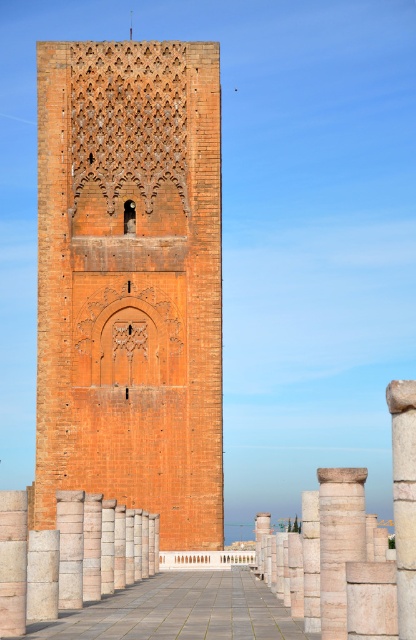
Question: Is light beige stone column at center smaller than smooth stone pillar at left?

Choices:
 (A) yes
 (B) no

Answer: (B)

Question: Which is farther from the light beige stone column at center?

Choices:
 (A) terracotta brick tower at center
 (B) smooth stone pillar at left

Answer: (A)

Question: Does light beige stone column at center have a lesser width compared to smooth stone pillar at left?

Choices:
 (A) yes
 (B) no

Answer: (B)

Question: Which point is farther from the camera taking this photo?

Choices:
 (A) (405, 589)
 (B) (62, 596)
 (C) (205, 84)

Answer: (C)

Question: Which object is closer to the camera taking this photo?

Choices:
 (A) white stone column at center
 (B) smooth stone pillar at center
 (C) light beige stone column at center
 (D) terracotta brick tower at center

Answer: (A)

Question: Is terracotta brick tower at center bigger than smooth stone pillar at left?

Choices:
 (A) yes
 (B) no

Answer: (A)